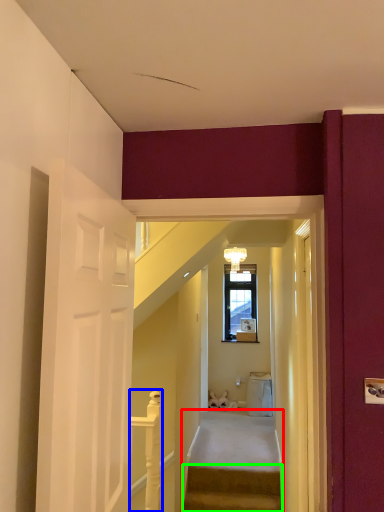
Question: Which is nearer to the stairs (highlighted by a red box)? balustrade (highlighted by a blue box) or stairs (highlighted by a green box).

Choices:
 (A) balustrade
 (B) stairs

Answer: (B)